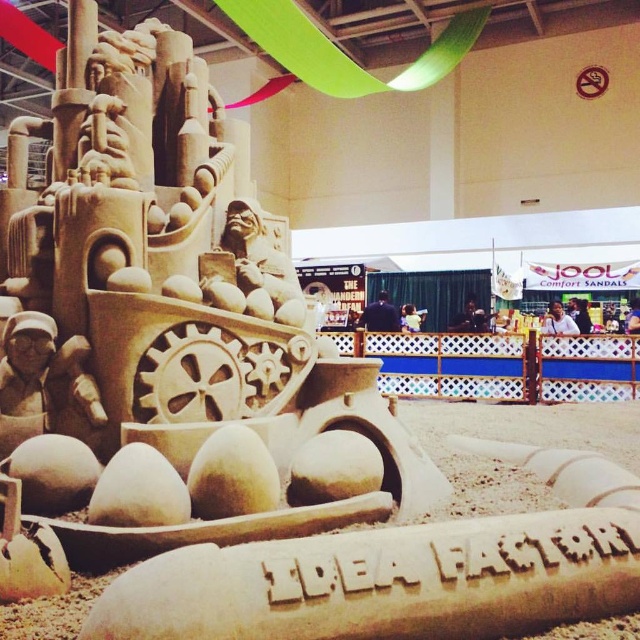
You are an event photographer at the exhibition hall. You need to capture a photo of the sand sculpture at center and the beige sand sculpture at lower center. Can you tell me which one is placed higher in the image?

The sand sculpture at center is positioned over the beige sand sculpture at lower center, so the sand sculpture at center is higher in the image.

You are a photographer standing at the entrance of the exhibition hall. You want to take a photo of the sand sculpture at center so that it fills the frame without any distortion. Given that your camera has a focal length of 50mm and you need to maintain a distance of at least 5 meters from the sculpture to avoid damaging it, can you position yourself appropriately?

The sand sculpture at center is 5.74 meters away from you, so yes, you can position yourself at that distance to take the photo without distortion since it meets the minimum required distance of 5 meters.